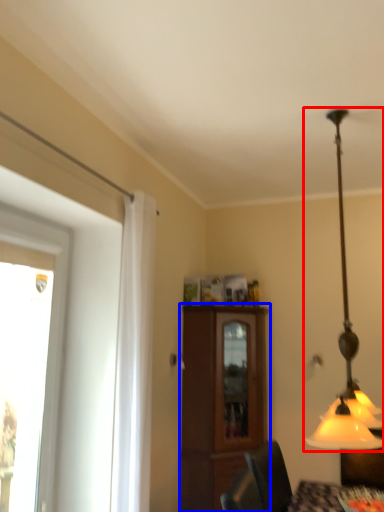
Question: Among these objects, which one is nearest to the camera, lamp (highlighted by a red box) or cabinetry (highlighted by a blue box)?

Choices:
 (A) lamp
 (B) cabinetry

Answer: (A)